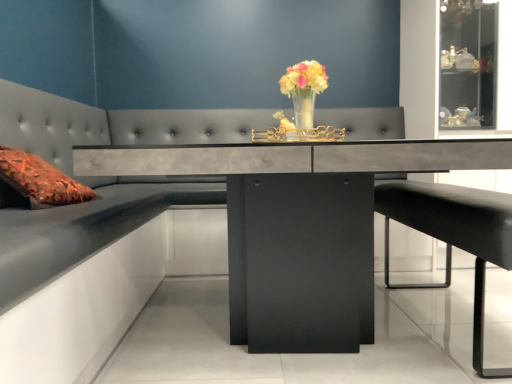
Question: From the image's perspective, is concrete gray table at center located above or below translucent glass vase at center?

Choices:
 (A) below
 (B) above

Answer: (A)

Question: In terms of height, does concrete gray table at center look taller or shorter compared to translucent glass vase at center?

Choices:
 (A) short
 (B) tall

Answer: (B)

Question: Estimate the real-world distances between objects in this image. Which object is farther from the translucent glass vase at center?

Choices:
 (A) concrete gray table at center
 (B) black leather bar stool at lower right

Answer: (B)

Question: Which object is positioned closest to the black leather bar stool at lower right?

Choices:
 (A) concrete gray table at center
 (B) translucent glass vase at center

Answer: (A)